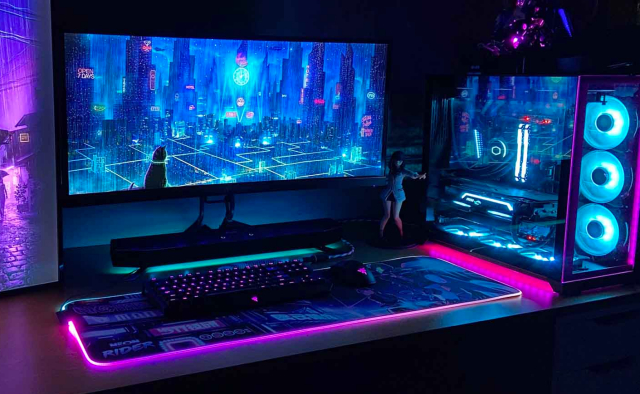
Locate an element on the screen. Image resolution: width=640 pixels, height=394 pixels. cpu tower is located at coordinates (545, 164).